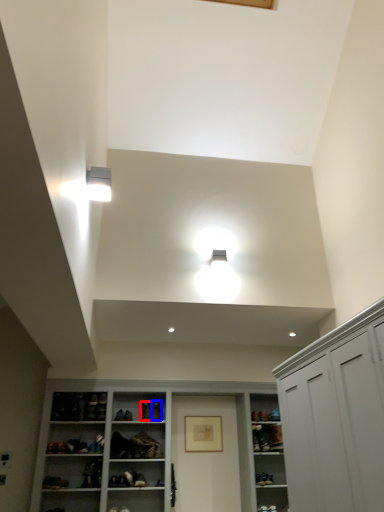
Question: Which object appears farthest to the camera in this image, shoe (highlighted by a red box) or shoe (highlighted by a blue box)?

Choices:
 (A) shoe
 (B) shoe

Answer: (B)